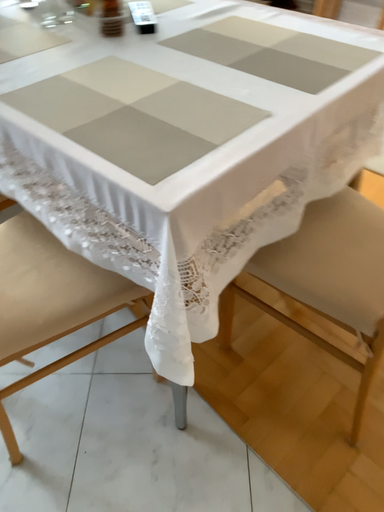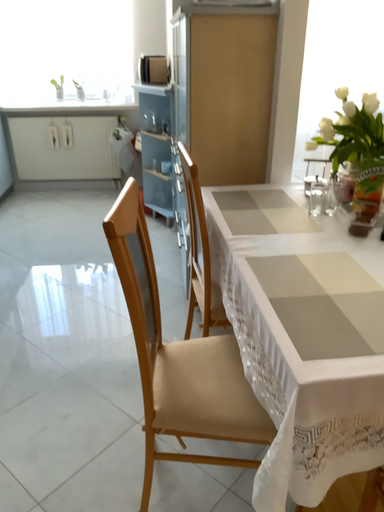
Question: Which way did the camera rotate in the video?

Choices:
 (A) rotated left
 (B) rotated right

Answer: (A)